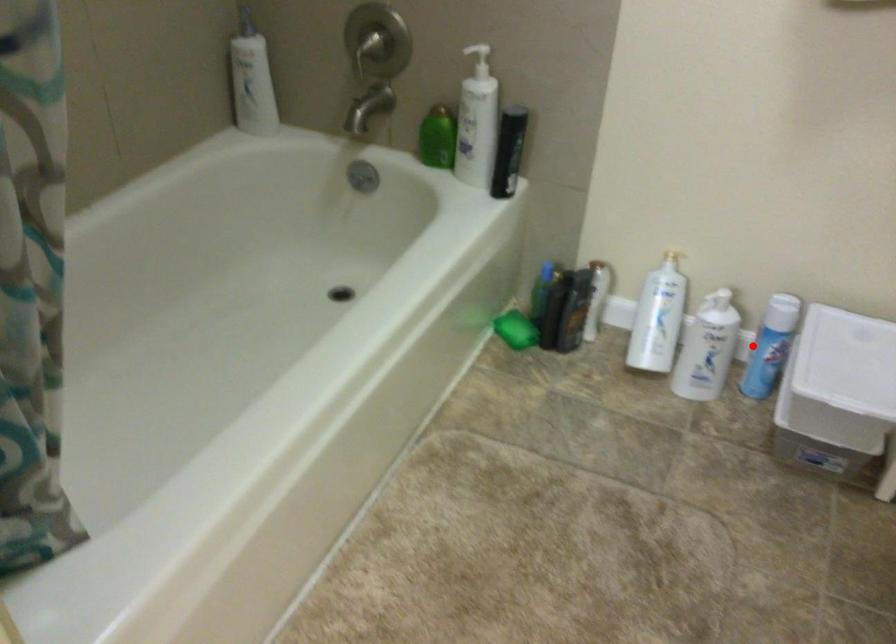
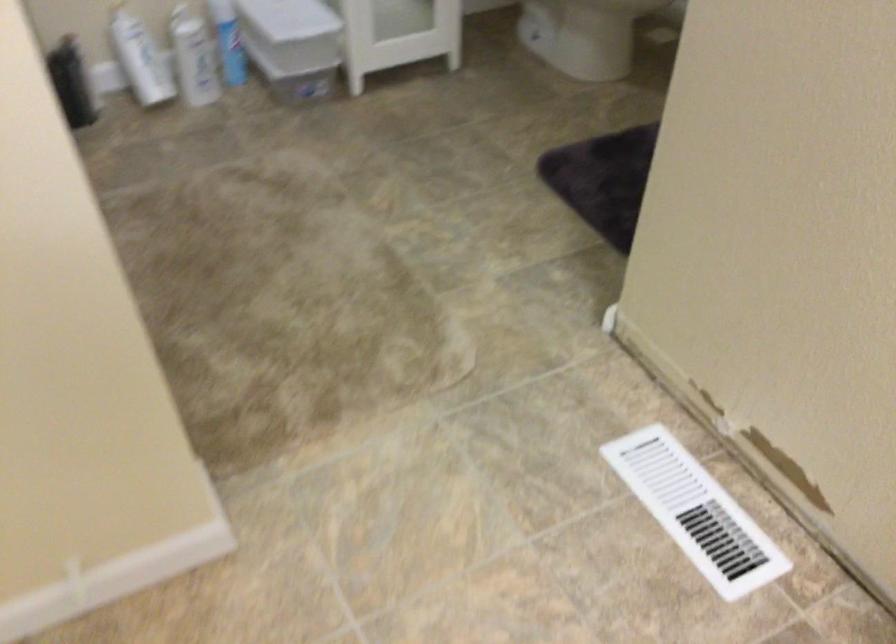
In the second image, find the point that corresponds to the highlighted location in the first image.

(228, 41)